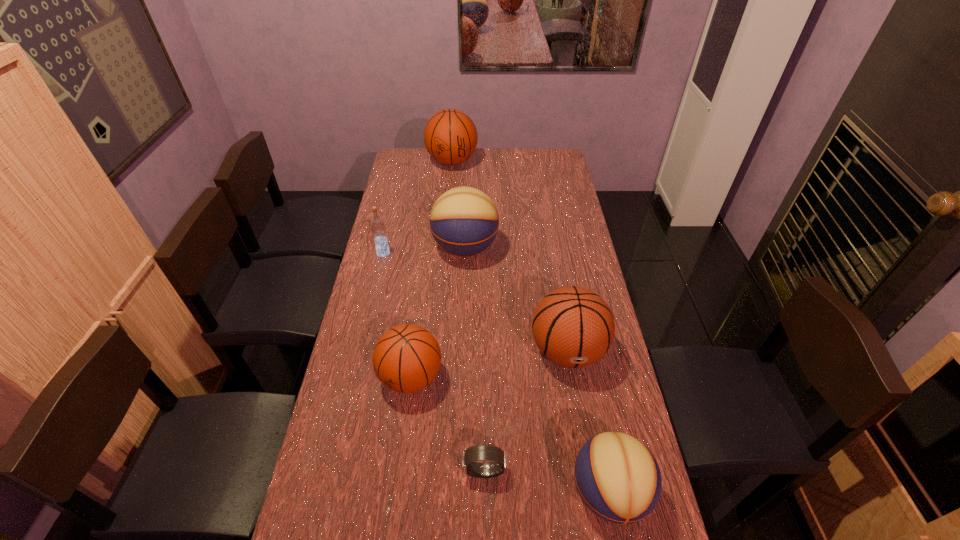
Identify the location of the farthest object. (450, 136).

Where is `the farthest basketball`? The width and height of the screenshot is (960, 540). the farthest basketball is located at coordinates (450, 136).

Image resolution: width=960 pixels, height=540 pixels. I want to click on the farther blue basketball, so click(464, 221).

This screenshot has width=960, height=540. Identify the location of the left blue basketball. (464, 221).

In order to click on the rightmost orange basketball in this screenshot , I will do `click(573, 327)`.

At what (x,y) coordinates should I click in order to perform the action: click on the leftmost object. Please return your answer as a coordinate pair (x, y). The width and height of the screenshot is (960, 540). Looking at the image, I should click on (378, 228).

This screenshot has height=540, width=960. What are the coordinates of `blue vodka` in the screenshot? It's located at [x=378, y=228].

This screenshot has height=540, width=960. I want to click on the smallest orange basketball, so click(407, 358).

Find the location of a particular element. The image size is (960, 540). the smaller blue basketball is located at coordinates (617, 477).

Where is `the nearest basketball`? the nearest basketball is located at coordinates (617, 477).